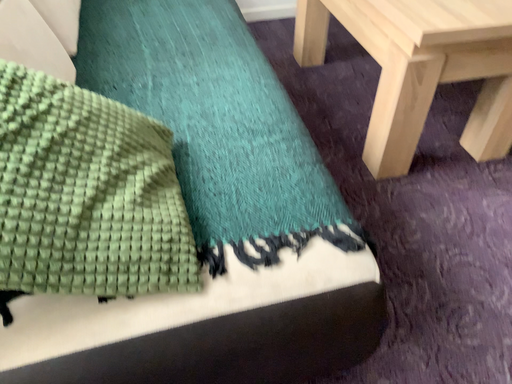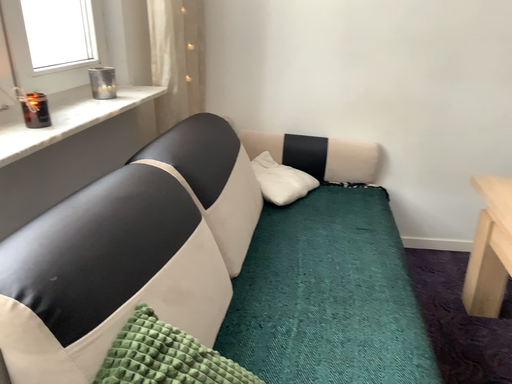
Question: Which way did the camera rotate in the video?

Choices:
 (A) rotated upward
 (B) rotated downward

Answer: (A)